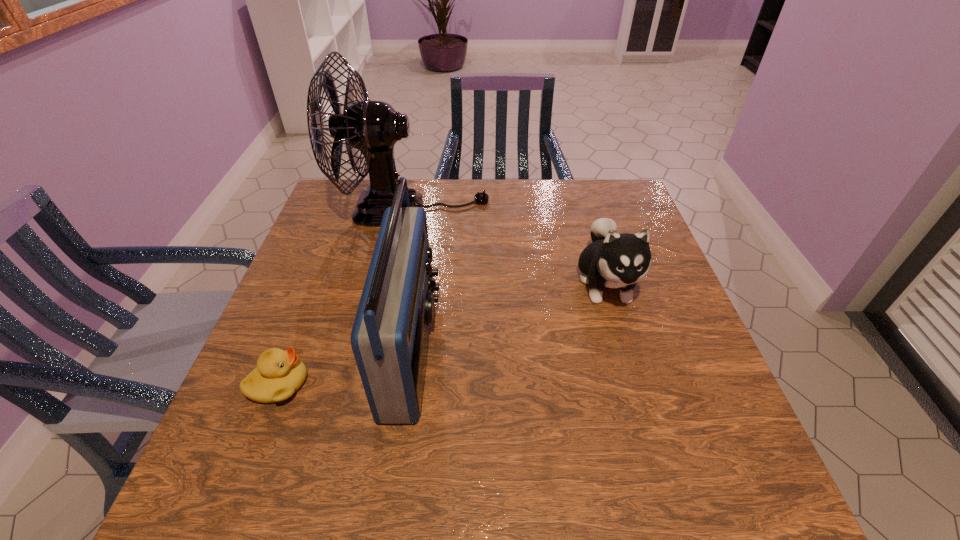
The width and height of the screenshot is (960, 540). What are the coordinates of `object that is at the far edge` in the screenshot? It's located at (373, 127).

You are a GUI agent. You are given a task and a screenshot of the screen. Output one action in this format:
    pyautogui.click(x=<x>, y=<y>)
    Task: Click on the fan present at the left edge
    The width and height of the screenshot is (960, 540).
    Given the screenshot: What is the action you would take?
    pyautogui.click(x=373, y=127)

I want to click on duckling that is positioned at the left edge, so click(x=279, y=374).

Identify the location of object that is positioned at the right edge. This screenshot has height=540, width=960. (613, 260).

Find the location of a particular element. The height and width of the screenshot is (540, 960). object that is positioned at the far left corner is located at coordinates (373, 127).

Locate an element on the screen. Image resolution: width=960 pixels, height=540 pixels. vacant area at the far edge of the desktop is located at coordinates (508, 190).

At what (x,y) coordinates should I click in order to perform the action: click on vacant space at the near edge. Please return your answer as a coordinate pair (x, y). The image size is (960, 540). Looking at the image, I should click on (562, 484).

This screenshot has width=960, height=540. What are the coordinates of `vacant space at the left edge of the desktop` in the screenshot? It's located at (296, 264).

You are a GUI agent. You are given a task and a screenshot of the screen. Output one action in this format:
    pyautogui.click(x=<x>, y=<y>)
    Task: Click on the blank space at the right edge of the desktop
    This screenshot has height=540, width=960.
    Given the screenshot: What is the action you would take?
    click(x=639, y=336)

Locate an element on the screen. free space at the far right corner is located at coordinates (625, 191).